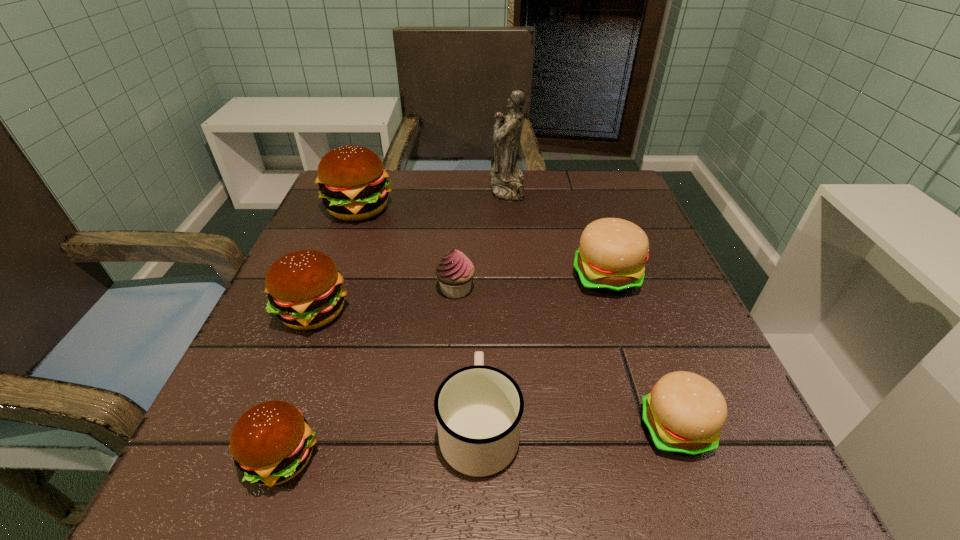
Locate an element on the screen. This screenshot has width=960, height=540. figurine is located at coordinates (507, 183).

Locate an element on the screen. the farthest hamburger is located at coordinates (352, 180).

This screenshot has height=540, width=960. What are the coordinates of `the farthest brown hamburger` in the screenshot? It's located at (352, 180).

Find the location of a particular element. Image resolution: width=960 pixels, height=540 pixels. the second farthest brown hamburger is located at coordinates (304, 288).

The image size is (960, 540). What are the coordinates of `the bigger beige hamburger` in the screenshot? It's located at (610, 260).

Find the location of a particular element. The image size is (960, 540). pink cupcake is located at coordinates (455, 271).

Find the location of a particular element. This screenshot has width=960, height=540. mug is located at coordinates click(x=478, y=408).

Find the location of `the smallest brown hamburger`. the smallest brown hamburger is located at coordinates [271, 443].

This screenshot has height=540, width=960. What are the coordinates of `the nearer beige hamburger` in the screenshot? It's located at (684, 413).

Locate an element on the screen. This screenshot has height=540, width=960. vacant space situated 0.260m on the front-facing side of the figurine is located at coordinates (387, 188).